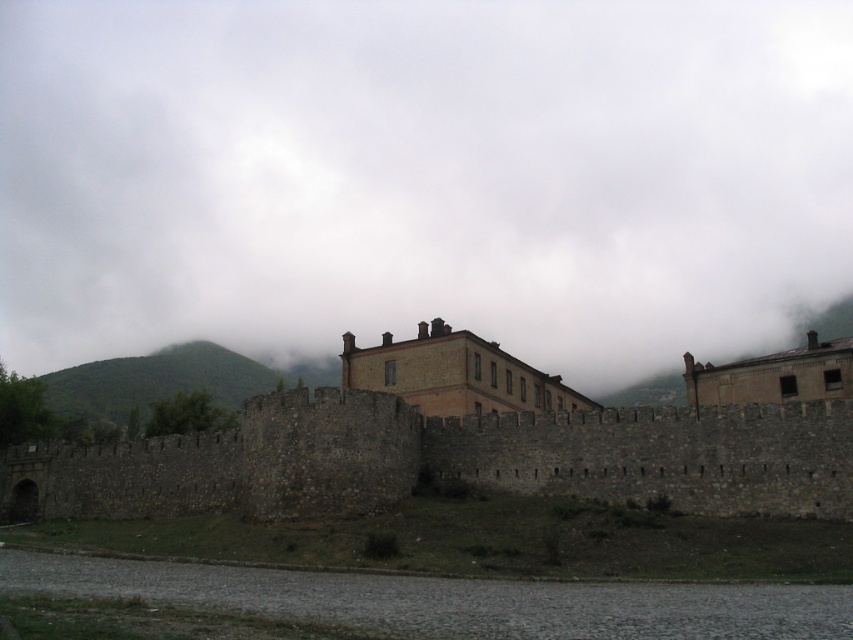
Can you confirm if white fluffy cloud at upper center is wider than stone wall at center?

Correct, the width of white fluffy cloud at upper center exceeds that of stone wall at center.

Locate an element on the screen. The height and width of the screenshot is (640, 853). white fluffy cloud at upper center is located at coordinates (422, 176).